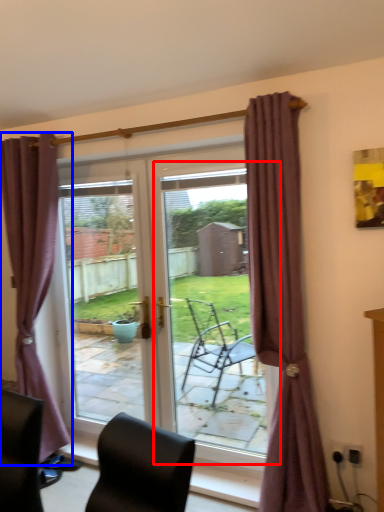
Question: Which object appears farthest to the camera in this image, screen door (highlighted by a red box) or curtain (highlighted by a blue box)?

Choices:
 (A) screen door
 (B) curtain

Answer: (B)